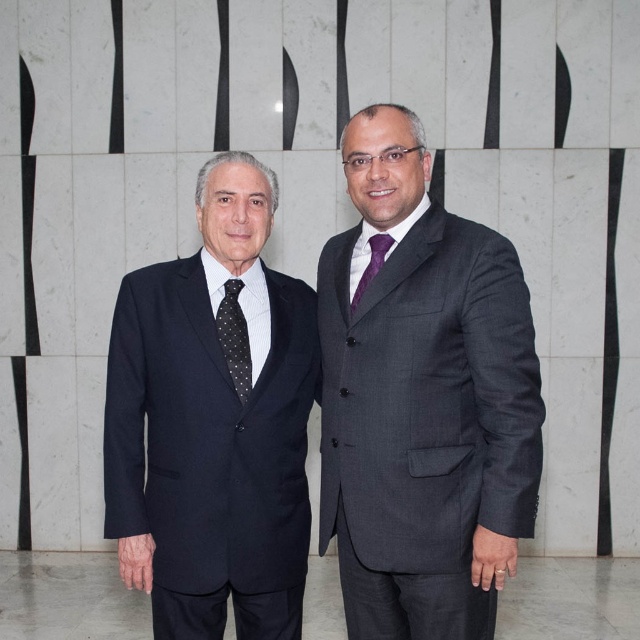
Question: Which object appears closest to the camera in this image?

Choices:
 (A) gray textured suit at right
 (B) matte black suit at left
 (C) dark gray suit at center

Answer: (C)

Question: Does dark gray suit at center appear over purple satin tie at center?

Choices:
 (A) yes
 (B) no

Answer: (B)

Question: Which point appears closest to the camera in this image?

Choices:
 (A) [246, 388]
 (B) [358, 195]

Answer: (B)

Question: Which of these objects is positioned farthest from the purple satin tie at center?

Choices:
 (A) matte black suit at left
 (B) black dotted tie at left
 (C) dark gray suit at center

Answer: (A)

Question: Is the position of dark gray suit at center more distant than that of matte black suit at left?

Choices:
 (A) yes
 (B) no

Answer: (B)

Question: Does dark gray suit at center appear under black dotted tie at left?

Choices:
 (A) yes
 (B) no

Answer: (A)